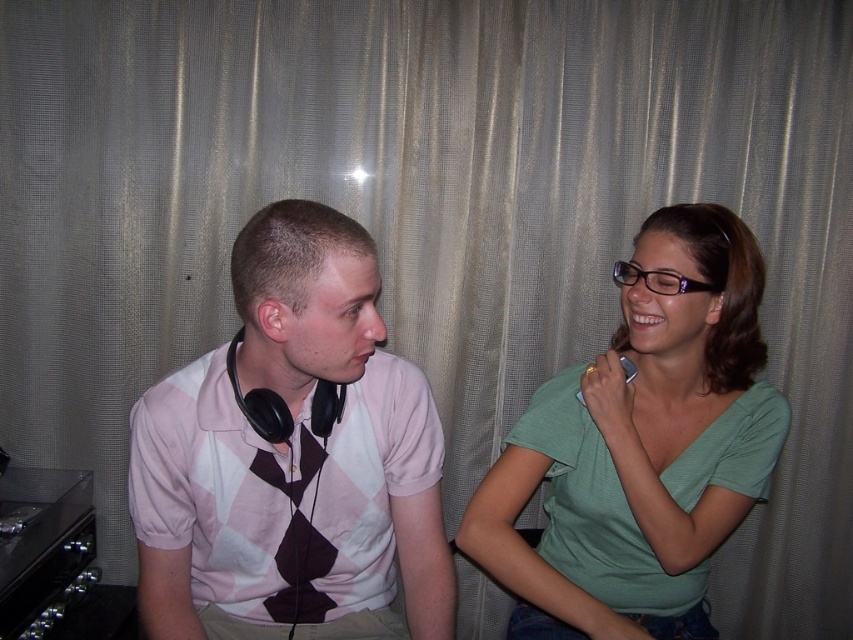
Question: Which point is closer to the camera?

Choices:
 (A) pink argyle shirt at center
 (B) green matte shirt at right

Answer: (A)

Question: Does pink argyle shirt at center have a lesser width compared to green matte shirt at right?

Choices:
 (A) no
 (B) yes

Answer: (B)

Question: Considering the relative positions of pink argyle shirt at center and green matte shirt at right in the image provided, where is pink argyle shirt at center located with respect to green matte shirt at right?

Choices:
 (A) left
 (B) right

Answer: (A)

Question: Which of the following is the closest to the observer?

Choices:
 (A) (663, 552)
 (B) (321, 508)

Answer: (B)

Question: Which of the following is the closest to the observer?

Choices:
 (A) green matte shirt at right
 (B) pink argyle shirt at center

Answer: (B)

Question: Does pink argyle shirt at center appear on the left side of green matte shirt at right?

Choices:
 (A) no
 (B) yes

Answer: (B)